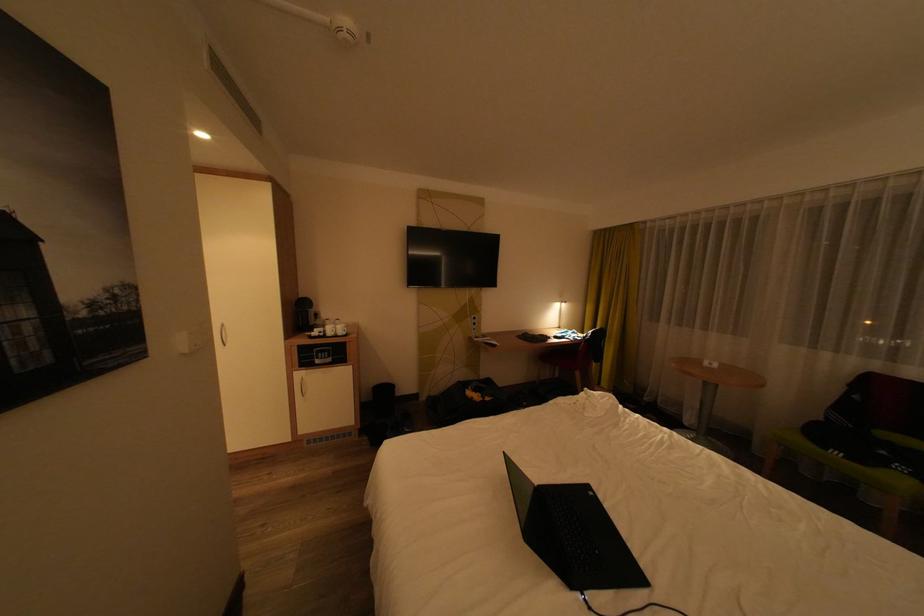
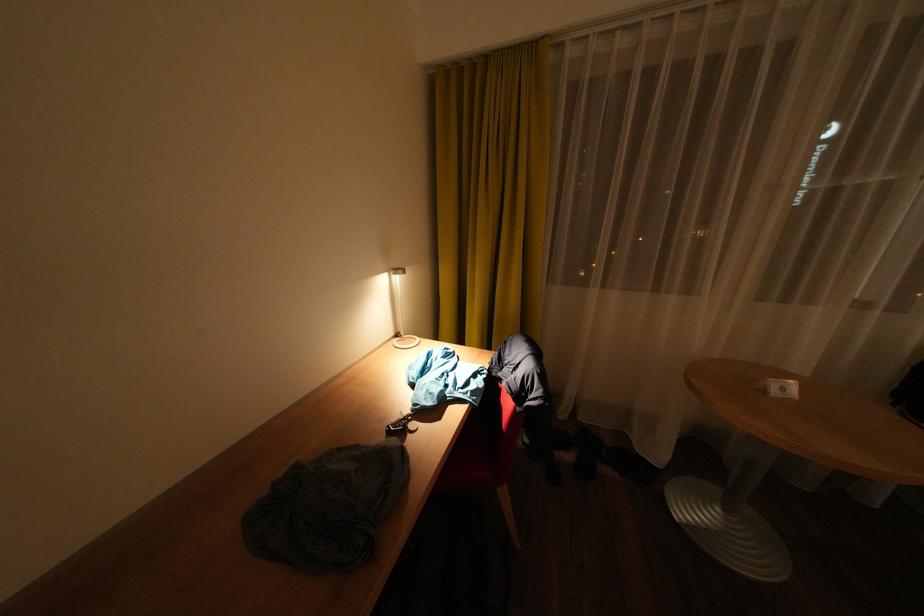
Find the pixel in the second image that matches point 642,225 in the first image.

(544, 47)